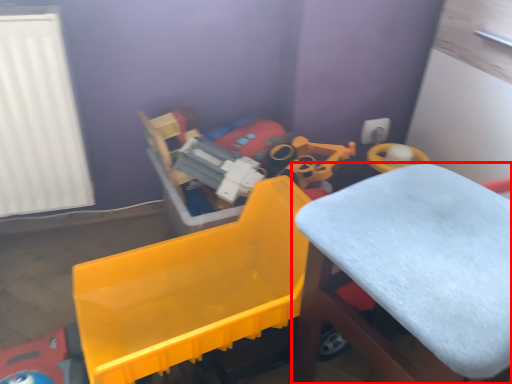
Question: From the image's perspective, what is the correct spatial relationship of furniture (annotated by the red box) in relation to toy?

Choices:
 (A) below
 (B) above

Answer: (A)